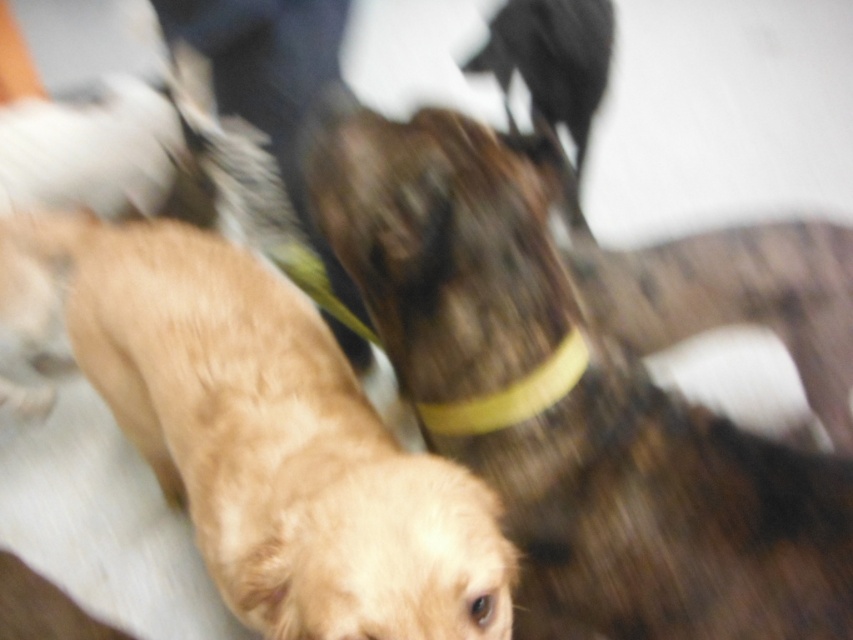
Question: Does brown fuzzy dog at center lie in front of golden fur dog at center?

Choices:
 (A) yes
 (B) no

Answer: (B)

Question: Observing the image, what is the correct spatial positioning of golden fur dog at center in reference to yellow rubber neckband at center?

Choices:
 (A) below
 (B) above

Answer: (A)

Question: Is brown fuzzy dog at center above yellow rubber neckband at center?

Choices:
 (A) yes
 (B) no

Answer: (B)

Question: Among these points, which one is nearest to the camera?

Choices:
 (A) (337, 520)
 (B) (537, 356)

Answer: (A)

Question: Estimate the real-world distances between objects in this image. Which object is farther from the golden fur dog at center?

Choices:
 (A) yellow rubber neckband at center
 (B) brown fuzzy dog at center

Answer: (A)

Question: Based on their relative distances, which object is farther from the golden fur dog at center?

Choices:
 (A) yellow rubber neckband at center
 (B) brown fuzzy dog at center

Answer: (A)